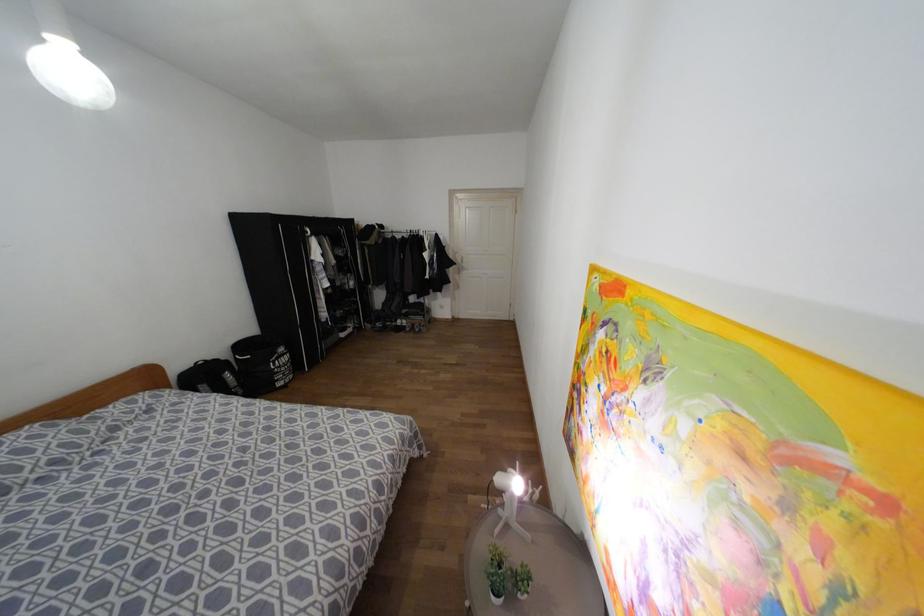
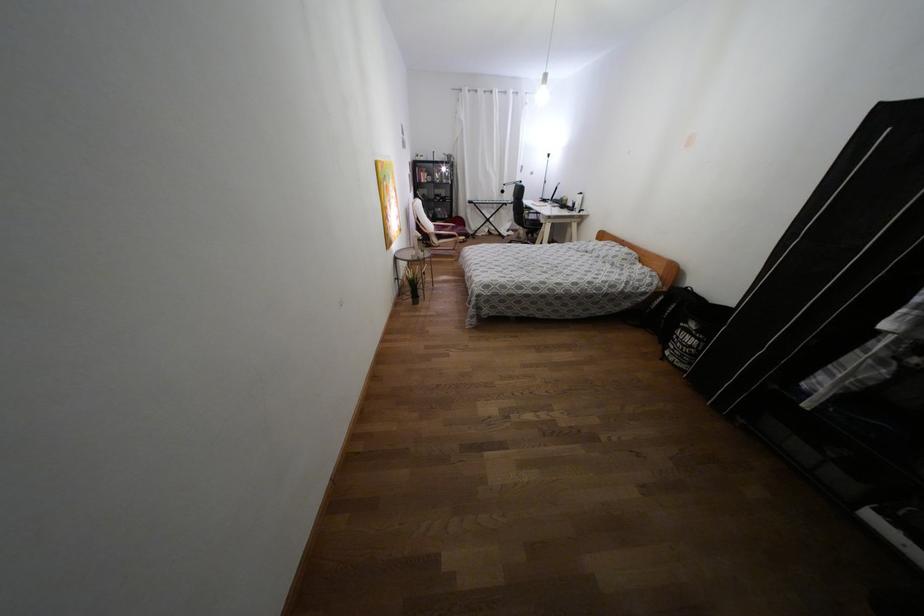
In the second image, find the point that corresponds to (277,367) in the first image.

(676, 337)